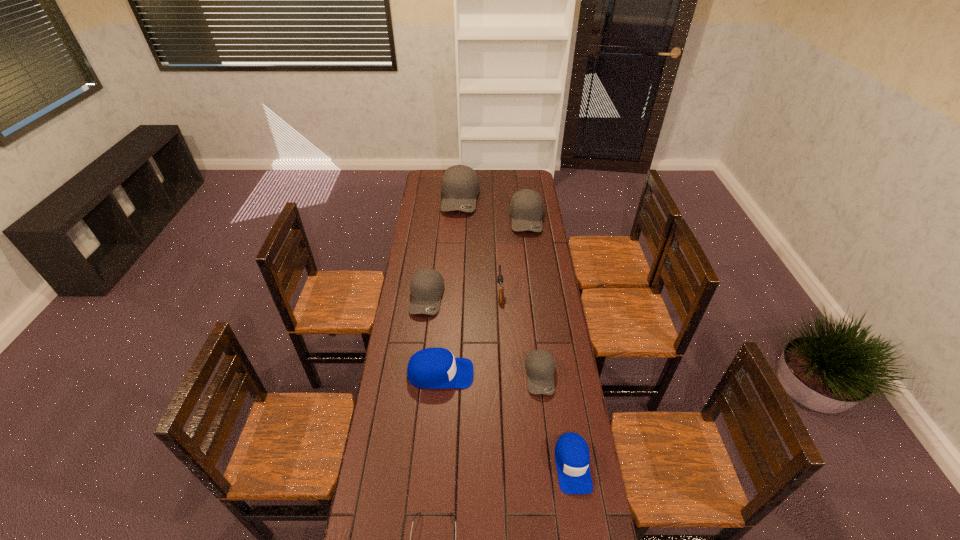
Where is `vacant point located between the second biggest gray baseball cap and the fourth object from right to left`? The height and width of the screenshot is (540, 960). vacant point located between the second biggest gray baseball cap and the fourth object from right to left is located at coordinates (514, 255).

In order to click on vacant point located between the fourth nearest baseball cap and the tallest object in this screenshot , I will do `click(444, 248)`.

Image resolution: width=960 pixels, height=540 pixels. What are the coordinates of `vacant space that's between the tallest object and the farther blue baseball cap` in the screenshot? It's located at (450, 286).

Where is `free space between the gun and the smallest gray baseball cap`? This screenshot has height=540, width=960. free space between the gun and the smallest gray baseball cap is located at coordinates (520, 334).

You are a GUI agent. You are given a task and a screenshot of the screen. Output one action in this format:
    pyautogui.click(x=<x>, y=<y>)
    Task: Click on the object that ranks as the second closest to the black sunglasses
    
    Given the screenshot: What is the action you would take?
    pyautogui.click(x=432, y=368)

Locate an element on the screen. The image size is (960, 540). the fifth closest object to the tallest baseball cap is located at coordinates (540, 364).

Select which baseball cap appears as the second closest to the black gun. Please provide its 2D coordinates. Your answer should be formatted as a tuple, i.e. [(x, y)], where the tuple contains the x and y coordinates of a point satisfying the conditions above.

[(540, 364)]

You are a GUI agent. You are given a task and a screenshot of the screen. Output one action in this format:
    pyautogui.click(x=<x>, y=<y>)
    Task: Click on the baseball cap that is the closest to the smallest gray baseball cap
    Image resolution: width=960 pixels, height=540 pixels.
    Given the screenshot: What is the action you would take?
    pyautogui.click(x=572, y=457)

Identify the location of gray baseball cap that is the fourth closest to the black gun. (460, 186).

Find the location of a particular element. The width and height of the screenshot is (960, 540). the third closest gray baseball cap relative to the fourth object from right to left is located at coordinates (526, 207).